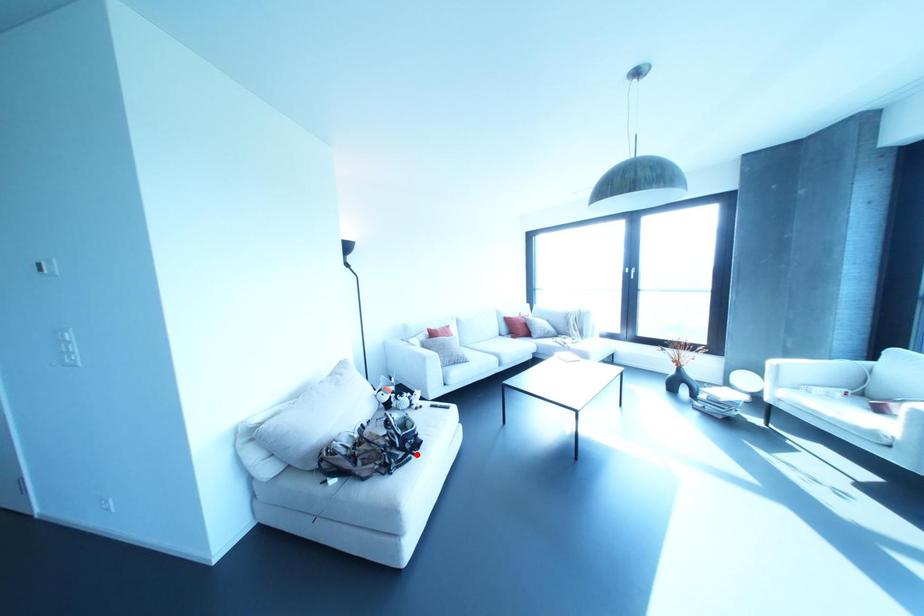
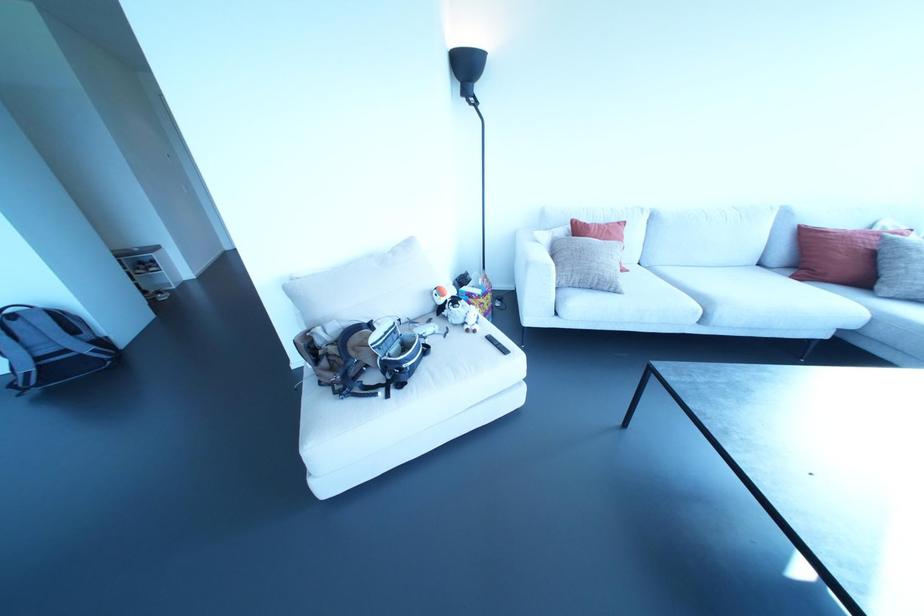
Where in the second image is the point corresponding to the highlighted location from the first image?

(386, 395)